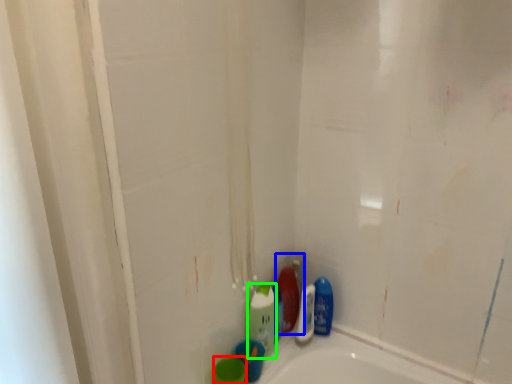
Question: Which is nearer to the mouthwash (highlighted by a red box)? cleaning product (highlighted by a blue box) or cleaning product (highlighted by a green box).

Choices:
 (A) cleaning product
 (B) cleaning product

Answer: (B)